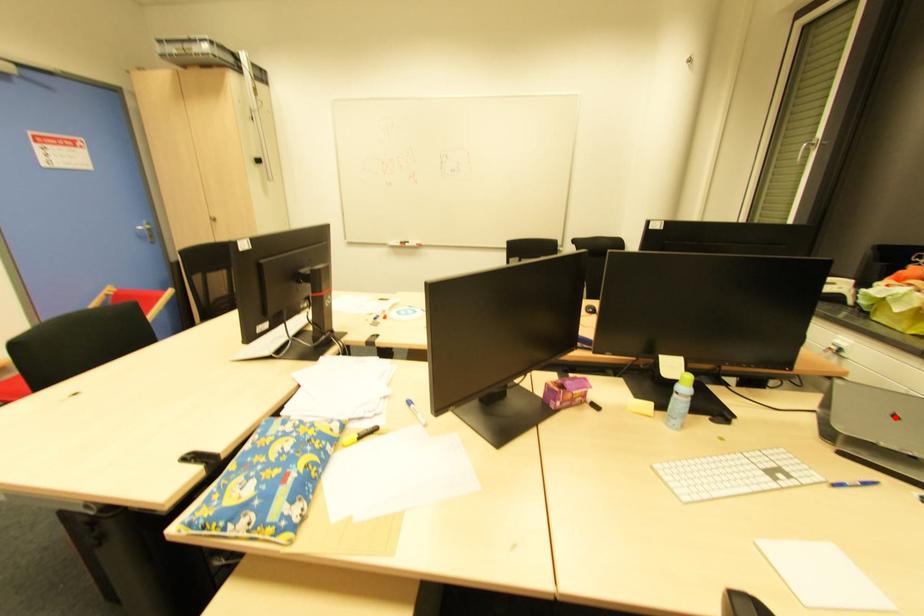
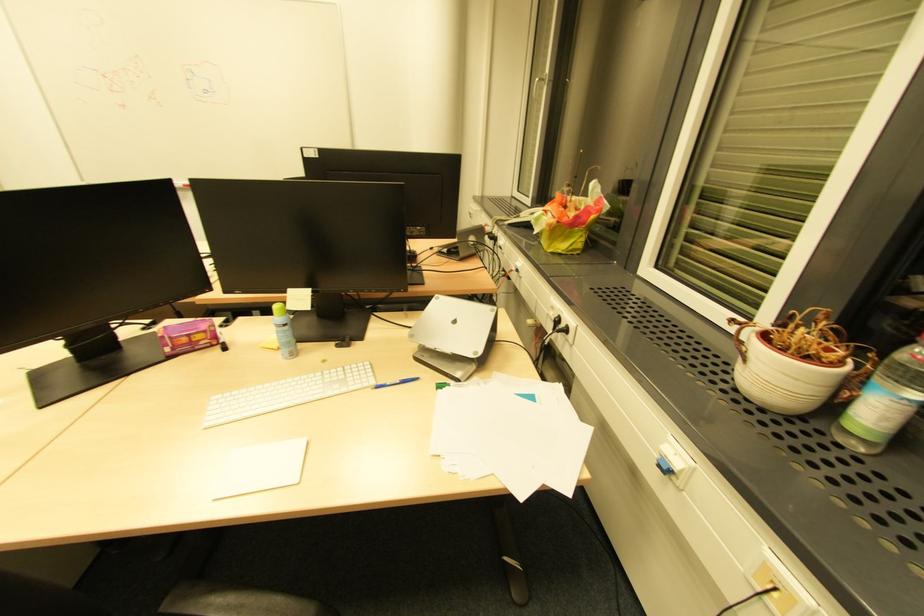
Question: I am providing you with two images of the same scene from different viewpoints. Given a red point in image1, look at the same physical point in image2. Is it:

Choices:
 (A) Closer to the viewpoint
 (B) Farther from the viewpoint

Answer: (B)